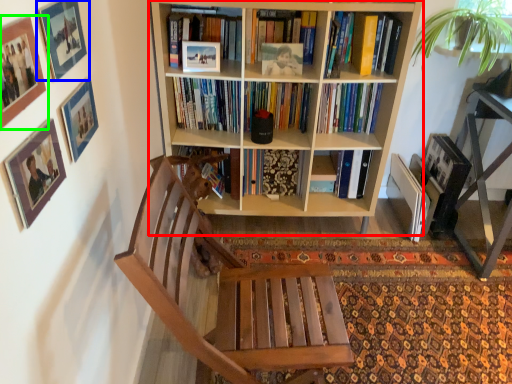
Question: Which object is the farthest from bookcase (highlighted by a red box)? Choose among these: picture frame (highlighted by a blue box) or picture frame (highlighted by a green box).

Choices:
 (A) picture frame
 (B) picture frame

Answer: (B)